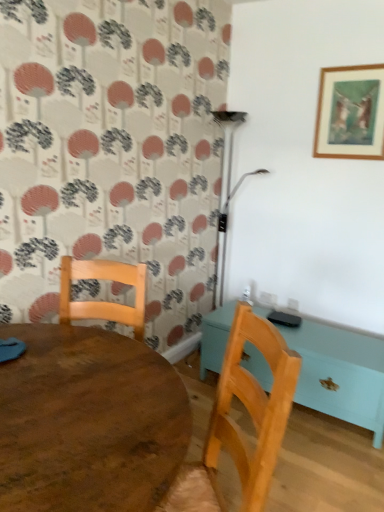
Question: Should I look upward or downward to see wooden table at center, which is the second table in right-to-left order?

Choices:
 (A) up
 (B) down

Answer: (B)

Question: From a real-world perspective, is wooden table at center, which is the second table in right-to-left order, on wooden table at center, the 1th table from the right?

Choices:
 (A) yes
 (B) no

Answer: (A)

Question: From the image's perspective, does wooden table at center, which is the second table in right-to-left order, appear higher than wooden table at center, the 1th table from the back?

Choices:
 (A) no
 (B) yes

Answer: (A)

Question: Considering the relative sizes of wooden table at center, the 1th table positioned from the left, and wooden table at center, the 2th table from the left, in the image provided, is wooden table at center, the 1th table positioned from the left, thinner than wooden table at center, the 2th table from the left,?

Choices:
 (A) yes
 (B) no

Answer: (B)

Question: Can you confirm if wooden table at center, the 1th table in the front-to-back sequence, is positioned to the right of wooden table at center, marked as the second table in a front-to-back arrangement?

Choices:
 (A) yes
 (B) no

Answer: (B)

Question: Can you confirm if wooden table at center, which is the 2th table from back to front, is shorter than wooden table at center, marked as the second table in a front-to-back arrangement?

Choices:
 (A) yes
 (B) no

Answer: (B)

Question: Is wooden table at center, the 2th table from the left, located within wooden table at center, which is the second table in right-to-left order?

Choices:
 (A) no
 (B) yes

Answer: (A)

Question: Considering the relative positions of wooden picture frame at upper right and wooden chair at lower center in the image provided, is wooden picture frame at upper right in front of wooden chair at lower center?

Choices:
 (A) yes
 (B) no

Answer: (B)

Question: Is wooden picture frame at upper right shorter than wooden chair at lower center?

Choices:
 (A) no
 (B) yes

Answer: (B)

Question: Is wooden picture frame at upper right touching wooden chair at lower center?

Choices:
 (A) yes
 (B) no

Answer: (B)

Question: Does wooden picture frame at upper right appear on the right side of wooden chair at lower center?

Choices:
 (A) no
 (B) yes

Answer: (B)

Question: Is wooden picture frame at upper right wider than wooden chair at lower center?

Choices:
 (A) yes
 (B) no

Answer: (B)

Question: Is the depth of wooden picture frame at upper right greater than that of wooden chair at lower center?

Choices:
 (A) yes
 (B) no

Answer: (A)

Question: Is wooden chair at lower center wider than wooden table at center, the 2th table from the left?

Choices:
 (A) yes
 (B) no

Answer: (A)